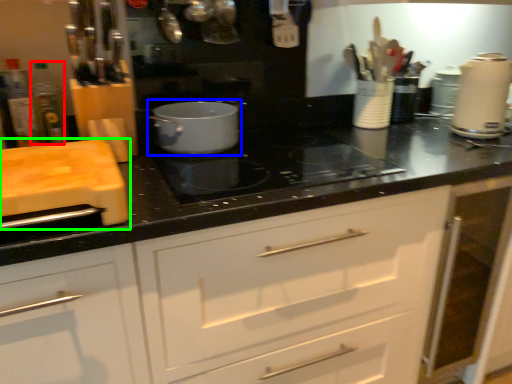
Question: Based on their relative distances, which object is nearer to bottle (highlighted by a red box)? Choose from kitchen appliance (highlighted by a blue box) and cutting board (highlighted by a green box).

Choices:
 (A) kitchen appliance
 (B) cutting board

Answer: (B)